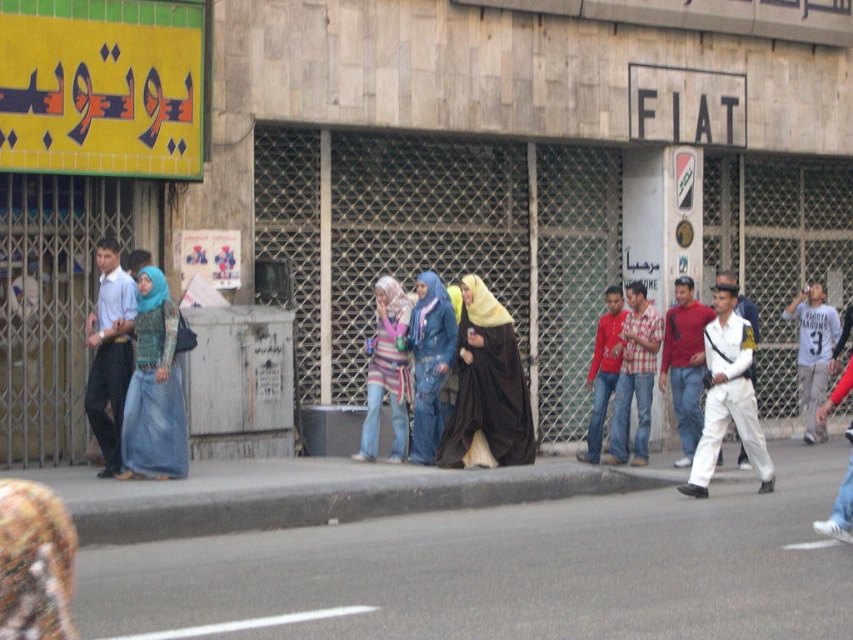
You are a photographer trying to capture the scene. You want to frame a shot that includes both the striped fabric scarf at center and the plaid cotton shirt at center. Which object should you place on the left side of your frame to ensure both are in the shot?

You should place the striped fabric scarf at center on the left side of your frame since it is already to the left of the plaid cotton shirt at center, ensuring both are included in the shot.

You are standing at the point marked by the coordinates point (154, 388). Looking around, you see a denim dress at left. What is the nearest object to your current position?

The nearest object to your current position at point (154, 388) is the denim dress at left, as it is located exactly at that coordinate.

In the scene shown: You are a delivery person carrying a box that is 10 feet long. You need to walk through the street scene shown in the image. There is a denim dress at left and a striped fabric scarf at center. Can you pass between them without tilting the box?

The distance between the denim dress at left and the striped fabric scarf at center is 8.48 feet. Since the box is 10 feet long, it is longer than the available space. You cannot pass between them without tilting the box.